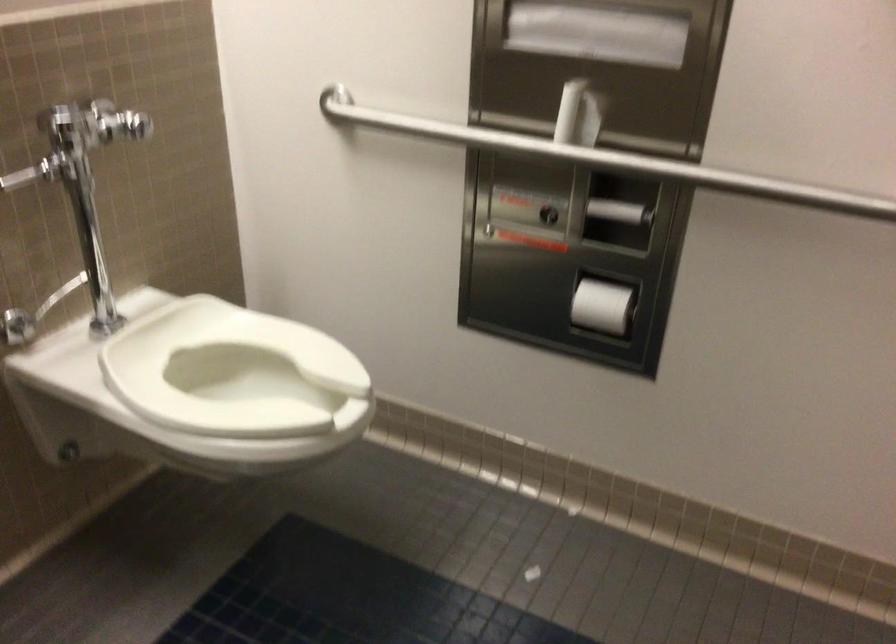
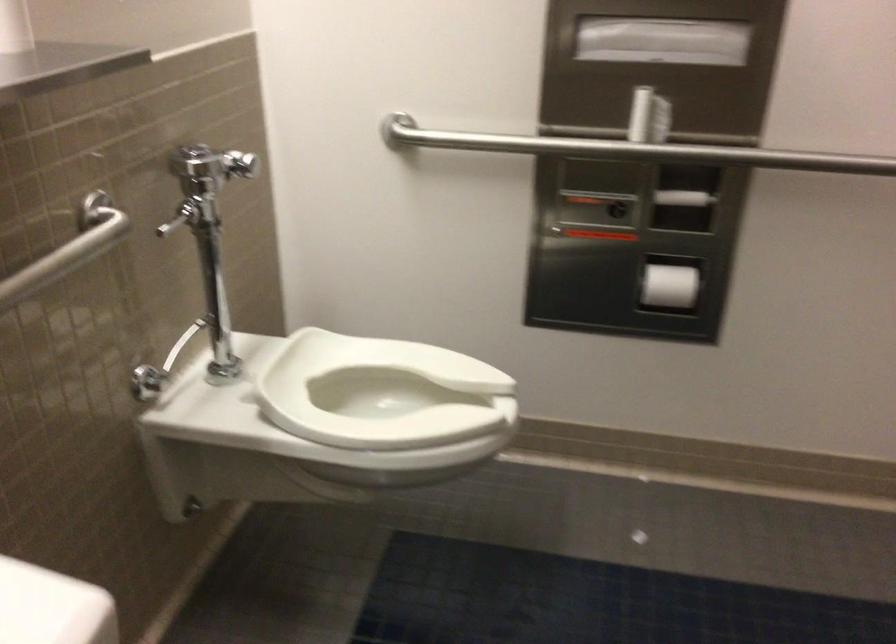
Where in the second image is the point corresponding to point (595, 306) from the first image?

(668, 287)